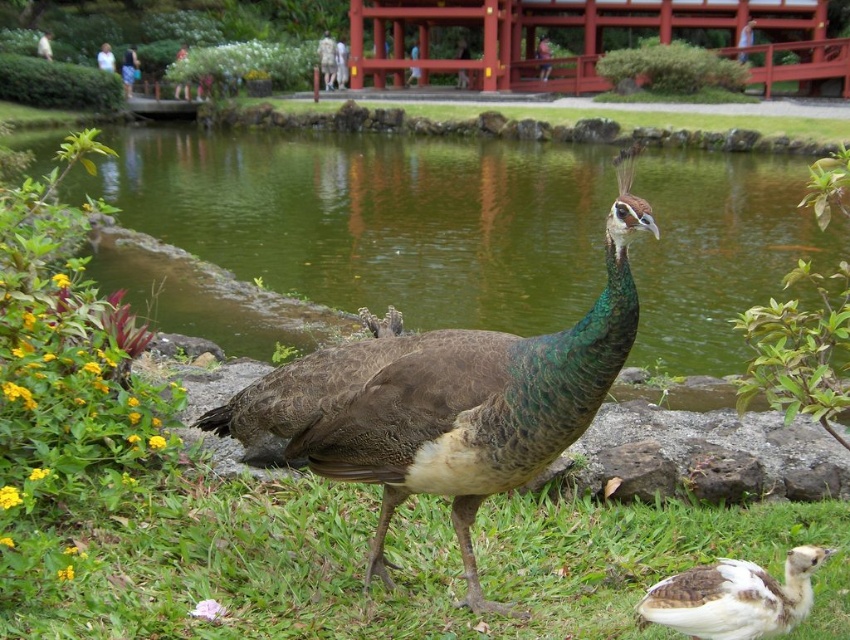
Is point (715, 369) positioned before point (389, 346)?

No, (715, 369) is further to viewer.

Is green water at center in front of green feathered peacock at center?

No, green water at center is further to the viewer.

Which is in front, point (676, 356) or point (369, 444)?

Point (369, 444) is more forward.

Image resolution: width=850 pixels, height=640 pixels. What are the coordinates of `green water at center` in the screenshot? It's located at (352, 228).

Which is in front, point (383, 438) or point (755, 612)?

Point (755, 612)

Who is more distant from viewer, (552, 412) or (695, 618)?

Positioned behind is point (552, 412).

You are a GUI agent. You are given a task and a screenshot of the screen. Output one action in this format:
    pyautogui.click(x=<x>, y=<y>)
    Task: Click on the green feathered peacock at center
    
    Given the screenshot: What is the action you would take?
    pyautogui.click(x=449, y=401)

Between green water at center and white downy duckling at center, which one appears on the left side from the viewer's perspective?

white downy duckling at center

Which is more to the right, green water at center or white downy duckling at center?

green water at center is more to the right.

Find the location of a particular element. green water at center is located at coordinates (352, 228).